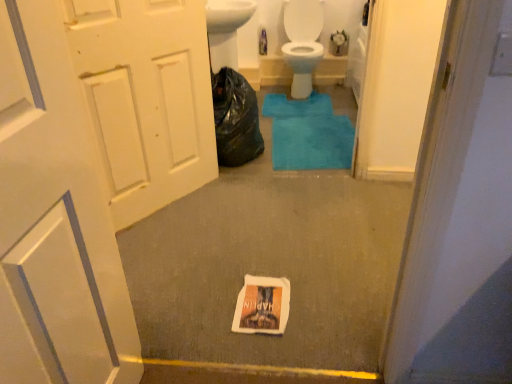
I want to click on free location in front of white matte door at left, which appears as the second door when viewed from the front, so click(176, 242).